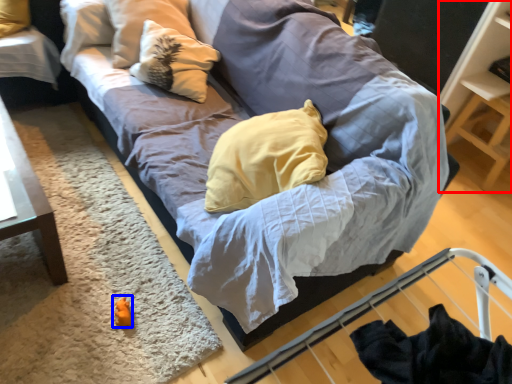
Question: Which point is closer to the camera, shelf (highlighted by a red box) or toy (highlighted by a blue box)?

Choices:
 (A) shelf
 (B) toy

Answer: (B)